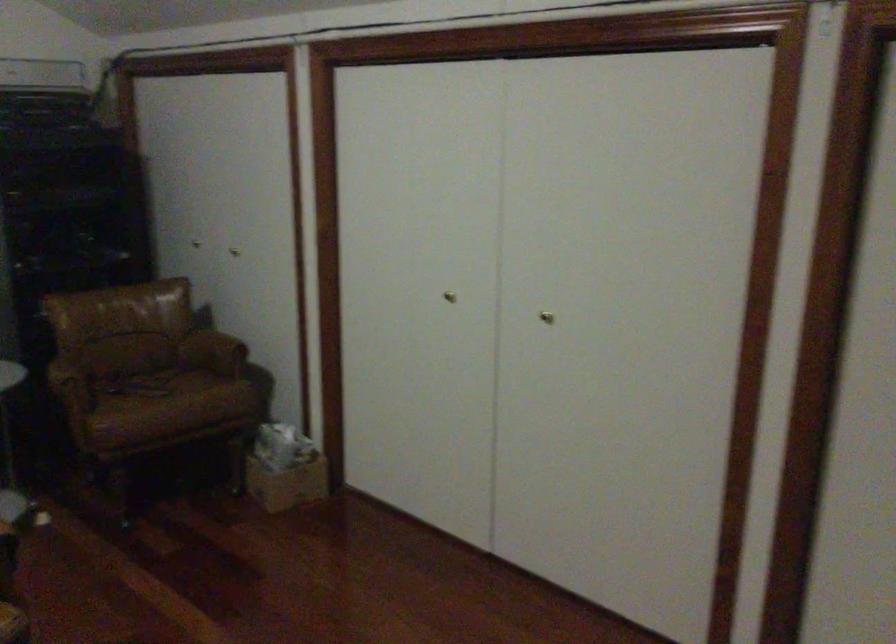
Describe the element at coordinates (149, 370) in the screenshot. This screenshot has height=644, width=896. I see `the chair armrest` at that location.